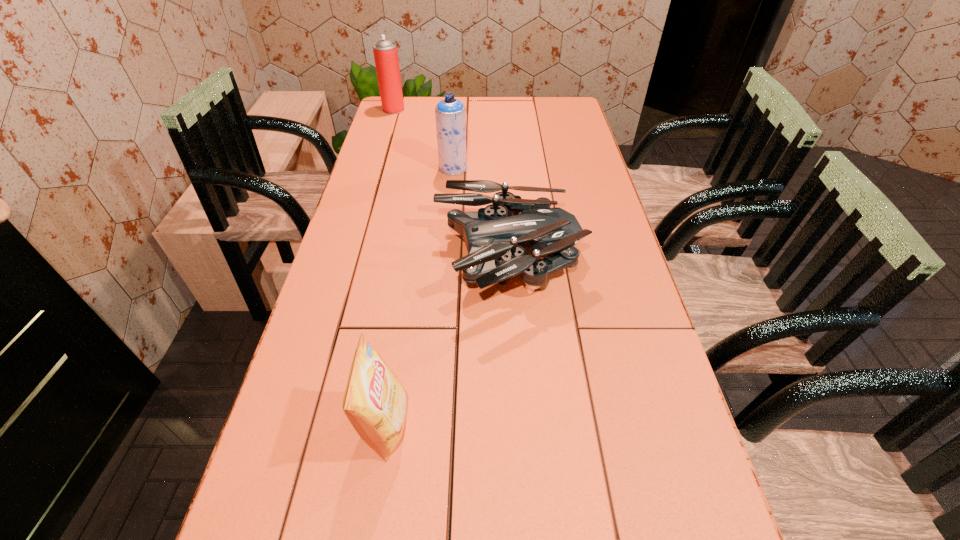
Locate an element on the screen. The image size is (960, 540). the leftmost object is located at coordinates (385, 52).

Locate an element on the screen. the left aerosol can is located at coordinates (385, 52).

Where is `the third nearest object`? the third nearest object is located at coordinates (450, 113).

This screenshot has width=960, height=540. I want to click on the nearer aerosol can, so click(450, 113).

You are a GUI agent. You are given a task and a screenshot of the screen. Output one action in this format:
    pyautogui.click(x=<x>, y=<y>)
    Task: Click on the crisp (potato chip)
    The image size is (960, 540).
    Given the screenshot: What is the action you would take?
    pyautogui.click(x=374, y=402)

Identify the location of the third tallest object. The width and height of the screenshot is (960, 540). (374, 402).

At what (x,y) coordinates should I click in order to perform the action: click on drone. Please return your answer as a coordinate pair (x, y). The width and height of the screenshot is (960, 540). Looking at the image, I should click on [495, 236].

Find the location of `the shortest object`. the shortest object is located at coordinates (495, 236).

You are a GUI agent. You are given a task and a screenshot of the screen. Output one action in this format:
    pyautogui.click(x=<x>, y=<y>)
    Task: Click on the vacant space situated 0.280m on the right of the leftmost object
    The height and width of the screenshot is (540, 960).
    Given the screenshot: What is the action you would take?
    [x=473, y=109]

The height and width of the screenshot is (540, 960). I want to click on vacant space located 0.380m on the front of the right aerosol can, so click(446, 254).